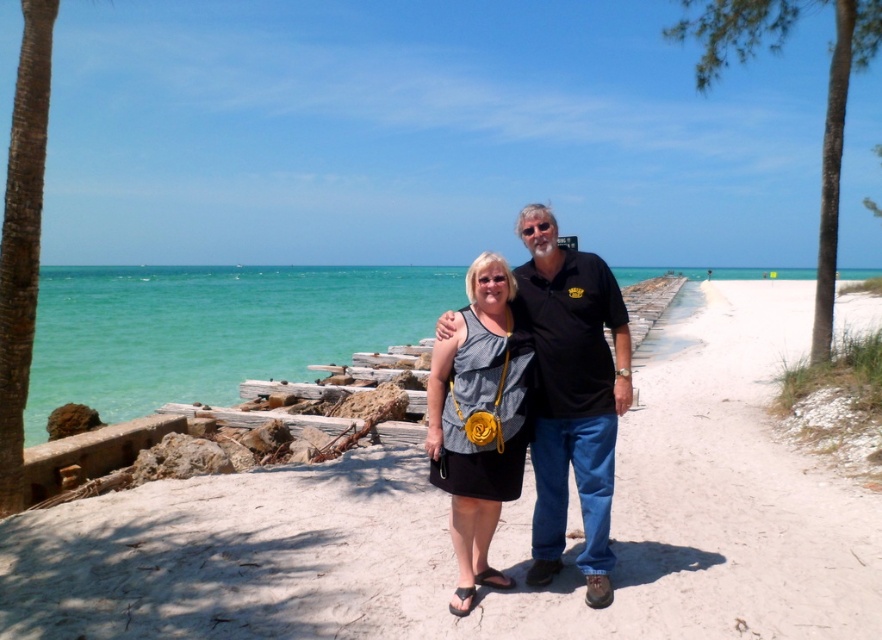
You are planning to set up a small picnic area on the white sand beach at center and under the green leafy palm tree at upper right. Based on the scene description, which location would provide more space for the picnic setup?

The green leafy palm tree at upper right provides more space for the picnic setup since the white sand beach at center has a smaller size compared to the green leafy palm tree at upper right.

You are a photographer positioned at the edge of the white sand beach at center. You want to capture a photo of the matte gray dress at center without any obstructions. Given that your camera has a maximum focus range of 6 meters, will you be able to clearly capture the dress in your photo?

The white sand beach at center and matte gray dress at center are 6.25 meters apart. Since the camera can only focus up to 6 meters, the distance is slightly beyond the camera s capability, so the dress may not be in clear focus.